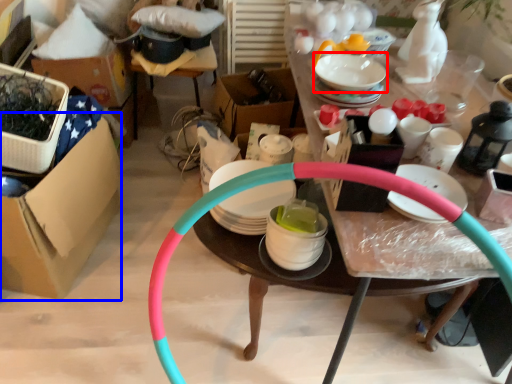
Question: Which of the following is the closest to the observer, tableware (highlighted by a red box) or cardboard box (highlighted by a blue box)?

Choices:
 (A) tableware
 (B) cardboard box

Answer: (B)